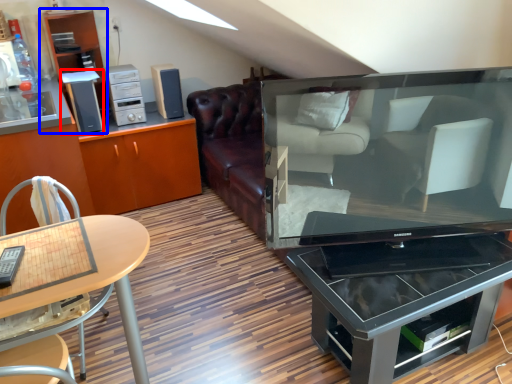
Question: Which object appears farthest to the camera in this image, appliance (highlighted by a red box) or shelf (highlighted by a blue box)?

Choices:
 (A) appliance
 (B) shelf

Answer: (A)